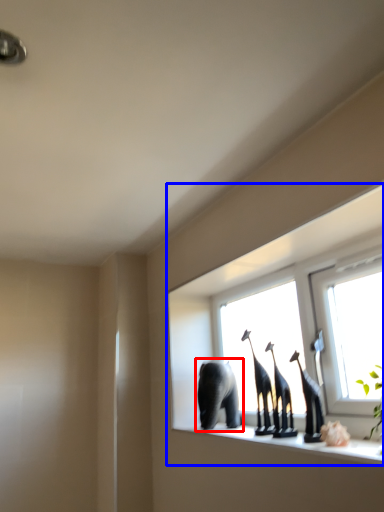
Question: Which object is closer to the camera taking this photo, elephant (highlighted by a red box) or window (highlighted by a blue box)?

Choices:
 (A) elephant
 (B) window

Answer: (B)